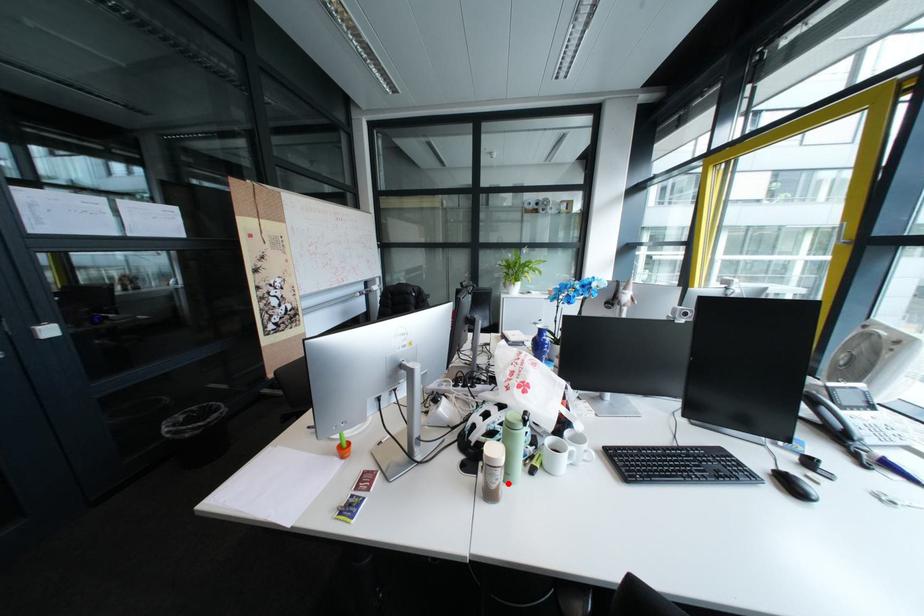
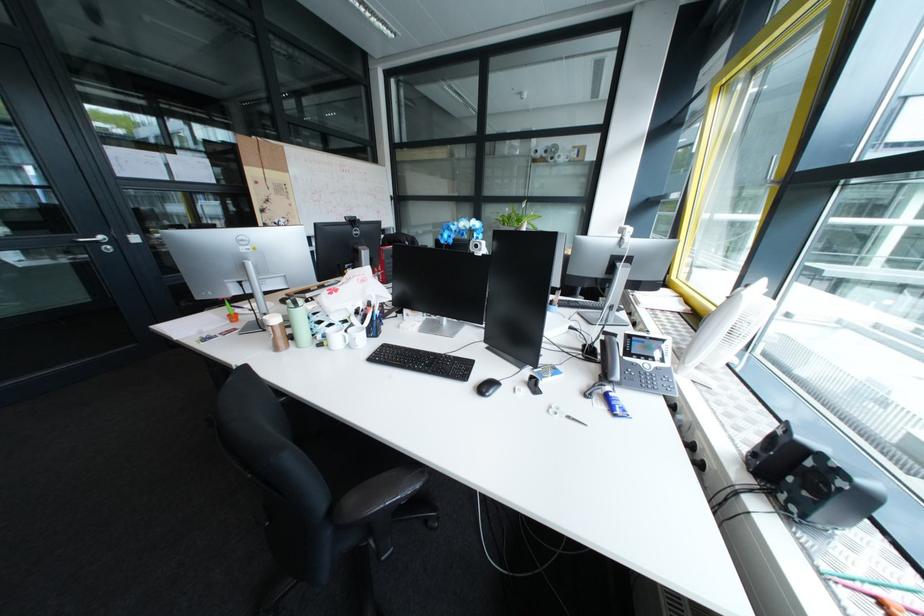
Question: I am providing you with two images of the same scene from different viewpoints. Image1 has a red point marked. In image2, the corresponding 3D location appears at what relative position? Reply with the corresponding letter.

Choices:
 (A) Closer
 (B) Farther

Answer: (A)